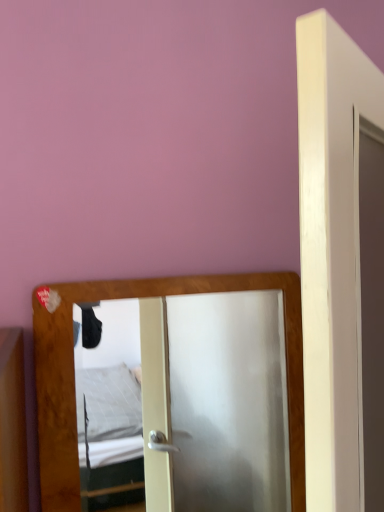
Question: Considering the positions of white matte door at center and wooden mirror at center in the image, is white matte door at center wider or thinner than wooden mirror at center?

Choices:
 (A) wide
 (B) thin

Answer: (B)

Question: Considering the positions of white matte door at center and wooden mirror at center in the image, is white matte door at center taller or shorter than wooden mirror at center?

Choices:
 (A) short
 (B) tall

Answer: (B)

Question: Relative to wooden mirror at center, is white matte door at center in front or behind?

Choices:
 (A) behind
 (B) front

Answer: (B)

Question: Considering the positions of wooden mirror at center and white matte door at center in the image, is wooden mirror at center taller or shorter than white matte door at center?

Choices:
 (A) tall
 (B) short

Answer: (B)

Question: Does point (283, 413) appear closer or farther from the camera than point (309, 180)?

Choices:
 (A) farther
 (B) closer

Answer: (A)

Question: Based on their positions, is wooden mirror at center located to the left or right of white matte door at center?

Choices:
 (A) left
 (B) right

Answer: (A)

Question: Relative to white matte door at center, is wooden mirror at center in front or behind?

Choices:
 (A) front
 (B) behind

Answer: (B)